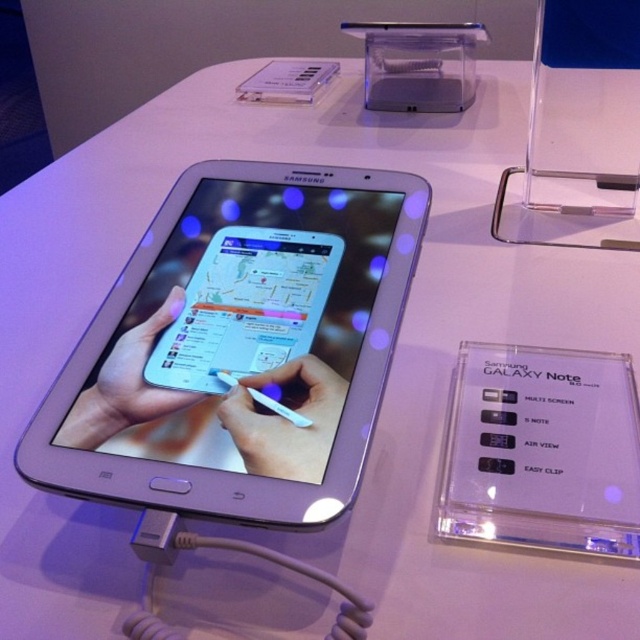
You are at a tech exhibition and see both the silver metallic tablet at center and the clear plastic samsung galaxy note at center. Which one do you think is larger in size?

The silver metallic tablet at center is bigger than the clear plastic samsung galaxy note at center.

You are at a tech exhibition and see the silver metallic tablet at center and the clear plastic samsung galaxy note at center. Which one is taller?

The silver metallic tablet at center is taller than the clear plastic samsung galaxy note at center.